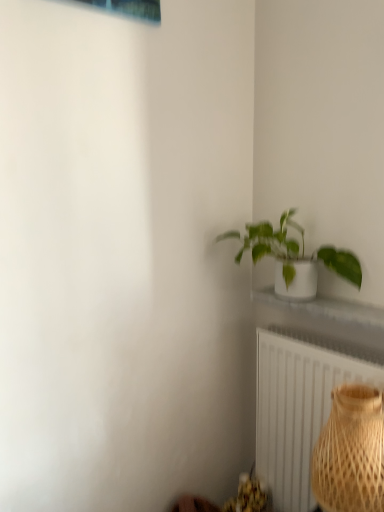
Describe the element at coordinates (351, 452) in the screenshot. I see `bamboo textured vase at lower right` at that location.

What are the coordinates of `bamboo textured vase at lower right` in the screenshot? It's located at (351, 452).

What's the angular difference between bamboo textured vase at lower right and white textured radiator at lower right's facing directions?

The facing directions of bamboo textured vase at lower right and white textured radiator at lower right are 1.7 degrees apart.

At what (x,y) coordinates should I click in order to perform the action: click on vase located above the white textured radiator at lower right (from the image's perspective). Please return your answer as a coordinate pair (x, y). The image size is (384, 512). Looking at the image, I should click on (351, 452).

Considering the sizes of objects bamboo textured vase at lower right and white textured radiator at lower right in the image provided, who is smaller, bamboo textured vase at lower right or white textured radiator at lower right?

bamboo textured vase at lower right.

From a real-world perspective, between bamboo textured vase at lower right and white textured radiator at lower right, who is vertically lower?

white textured radiator at lower right is physically lower.

Considering the relative sizes of green glossy plant at upper right and bamboo textured vase at lower right in the image provided, is green glossy plant at upper right shorter than bamboo textured vase at lower right?

Yes, green glossy plant at upper right is shorter than bamboo textured vase at lower right.

Which of these two, green glossy plant at upper right or bamboo textured vase at lower right, is bigger?

green glossy plant at upper right is bigger.

Based on their positions, is green glossy plant at upper right located to the left or right of bamboo textured vase at lower right?

In the image, green glossy plant at upper right appears on the left side of bamboo textured vase at lower right.

Could you tell me if green glossy plant at upper right is facing bamboo textured vase at lower right?

No, green glossy plant at upper right is not turned towards bamboo textured vase at lower right.

Is green glossy plant at upper right surrounded by white textured radiator at lower right?

No, green glossy plant at upper right is located outside of white textured radiator at lower right.

Considering the positions of objects white textured radiator at lower right and green glossy plant at upper right in the image provided, who is behind, white textured radiator at lower right or green glossy plant at upper right?

white textured radiator at lower right.

Can you confirm if white textured radiator at lower right is smaller than green glossy plant at upper right?

Actually, white textured radiator at lower right might be larger than green glossy plant at upper right.

Does white textured radiator at lower right turn towards green glossy plant at upper right?

No, white textured radiator at lower right is not oriented towards green glossy plant at upper right.

Between bamboo textured vase at lower right and green glossy plant at upper right, which one has more height?

bamboo textured vase at lower right.

Is bamboo textured vase at lower right wider or thinner than green glossy plant at upper right?

Considering their sizes, bamboo textured vase at lower right looks broader than green glossy plant at upper right.

From the image's perspective, which one is positioned lower, bamboo textured vase at lower right or green glossy plant at upper right?

bamboo textured vase at lower right.

Is point (355, 414) farther from camera compared to point (283, 228)?

No, (355, 414) is closer to viewer.

Is green glossy plant at upper right positioned with its back to white textured radiator at lower right?

No, white textured radiator at lower right is not at the back of green glossy plant at upper right.

Is green glossy plant at upper right taller or shorter than white textured radiator at lower right?

Considering their sizes, green glossy plant at upper right has less height than white textured radiator at lower right.

Can you confirm if green glossy plant at upper right is wider than white textured radiator at lower right?

Correct, the width of green glossy plant at upper right exceeds that of white textured radiator at lower right.

Does green glossy plant at upper right lie in front of white textured radiator at lower right?

That is True.

From a real-world perspective, who is located lower, white textured radiator at lower right or bamboo textured vase at lower right?

In real-world perspective, white textured radiator at lower right is lower.

The width and height of the screenshot is (384, 512). In order to click on vase in front of the white textured radiator at lower right in this screenshot , I will do `click(351, 452)`.

Which object is more forward, white textured radiator at lower right or bamboo textured vase at lower right?

bamboo textured vase at lower right is in front.

From the image's perspective, which one is positioned lower, white textured radiator at lower right or bamboo textured vase at lower right?

white textured radiator at lower right, from the image's perspective.

Locate an element on the screen. radiator behind the bamboo textured vase at lower right is located at coordinates (297, 410).

Image resolution: width=384 pixels, height=512 pixels. In order to click on houseplant above the bamboo textured vase at lower right (from a real-world perspective) in this screenshot , I will do `click(296, 251)`.

Based on their spatial positions, is green glossy plant at upper right or bamboo textured vase at lower right closer to white textured radiator at lower right?

Based on the image, bamboo textured vase at lower right appears to be nearer to white textured radiator at lower right.

Which object lies further to the anchor point bamboo textured vase at lower right, white textured radiator at lower right or green glossy plant at upper right?

Among the two, green glossy plant at upper right is located further to bamboo textured vase at lower right.

From the image, which object appears to be nearer to green glossy plant at upper right, bamboo textured vase at lower right or white textured radiator at lower right?

white textured radiator at lower right lies closer to green glossy plant at upper right than the other object.

Looking at the image, which one is located closer to green glossy plant at upper right, white textured radiator at lower right or bamboo textured vase at lower right?

white textured radiator at lower right is positioned closer to the anchor green glossy plant at upper right.

Estimate the real-world distances between objects in this image. Which object is further from bamboo textured vase at lower right, green glossy plant at upper right or white textured radiator at lower right?

The object further to bamboo textured vase at lower right is green glossy plant at upper right.

From the image, which object appears to be nearer to white textured radiator at lower right, bamboo textured vase at lower right or green glossy plant at upper right?

Based on the image, bamboo textured vase at lower right appears to be nearer to white textured radiator at lower right.

This screenshot has width=384, height=512. I want to click on vase between green glossy plant at upper right and white textured radiator at lower right in the up-down direction, so click(351, 452).